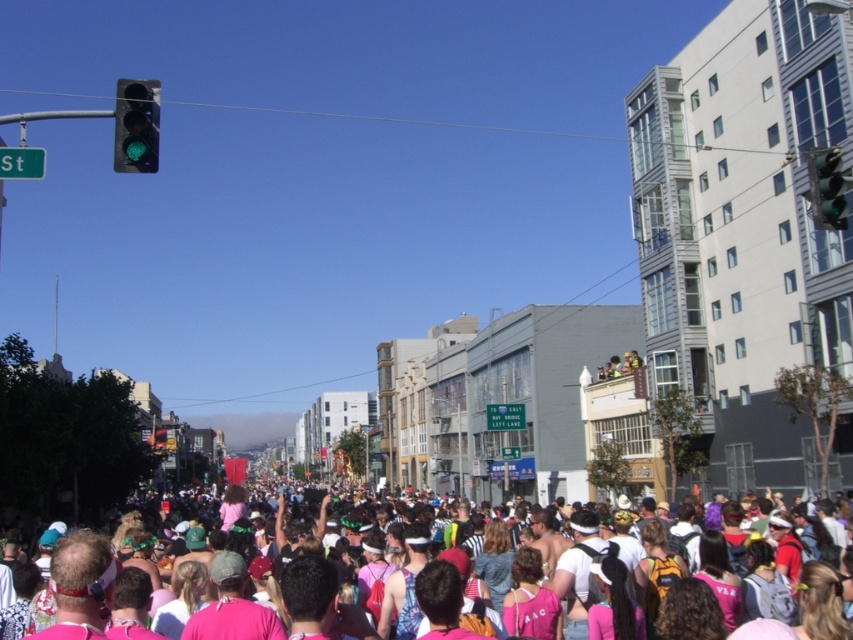
Question: Which point is farther from the camera taking this photo?

Choices:
 (A) pyautogui.click(x=289, y=563)
 (B) pyautogui.click(x=824, y=147)
 (C) pyautogui.click(x=123, y=83)

Answer: (B)

Question: Can you confirm if green glass traffic light at upper left is wider than pink fabric crowd at center?

Choices:
 (A) yes
 (B) no

Answer: (A)

Question: Is green glass traffic light at upper left smaller than green glass traffic light at upper right?

Choices:
 (A) no
 (B) yes

Answer: (A)

Question: Among these points, which one is nearest to the camera?

Choices:
 (A) (816, 221)
 (B) (142, 129)

Answer: (B)

Question: Does green glass traffic light at upper left appear over green glass traffic light at upper right?

Choices:
 (A) yes
 (B) no

Answer: (A)

Question: Which point is closer to the camera?

Choices:
 (A) (405, 636)
 (B) (820, 220)
 (C) (134, 163)

Answer: (C)